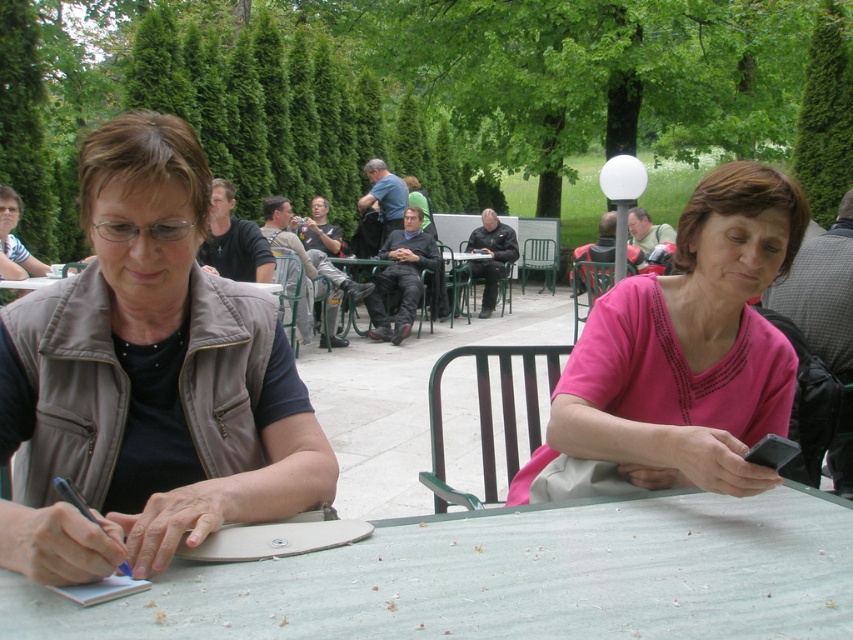
You are a photographer taking a picture of the two people at the table. The pink fabric shirt at center and the black matte shirt at center are both in the frame. Which shirt is positioned lower in the image?

The pink fabric shirt at center is positioned lower in the image because it is below the black matte shirt at center.